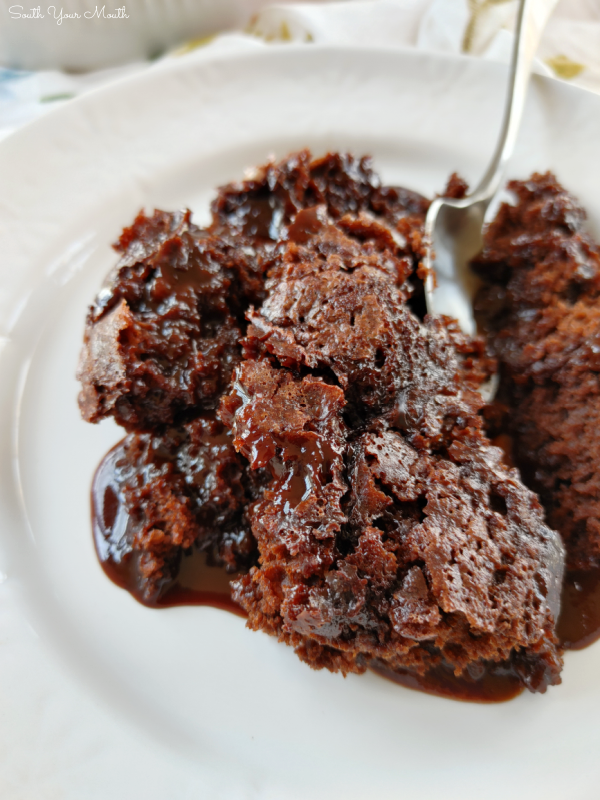
The height and width of the screenshot is (800, 600). Identify the location of handle. (531, 22).